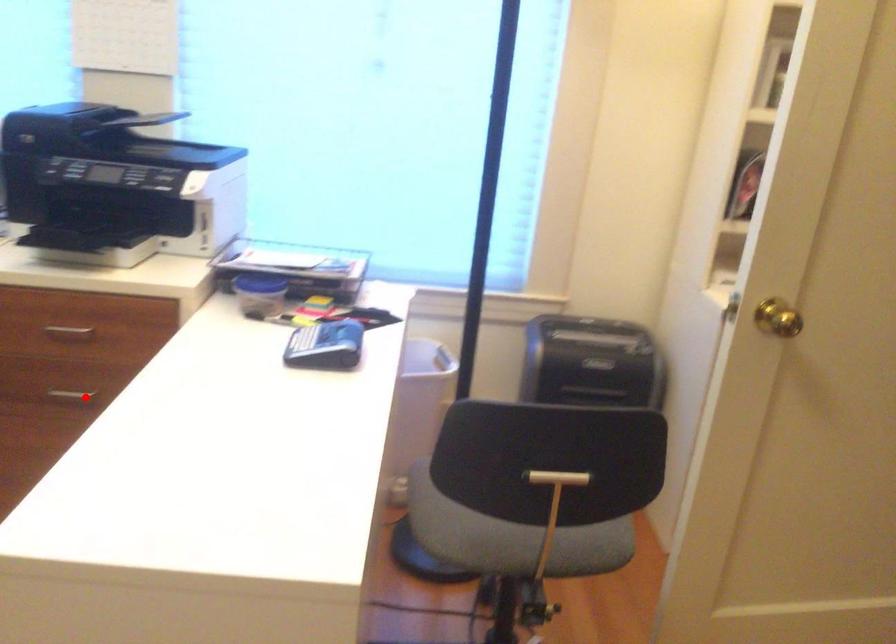
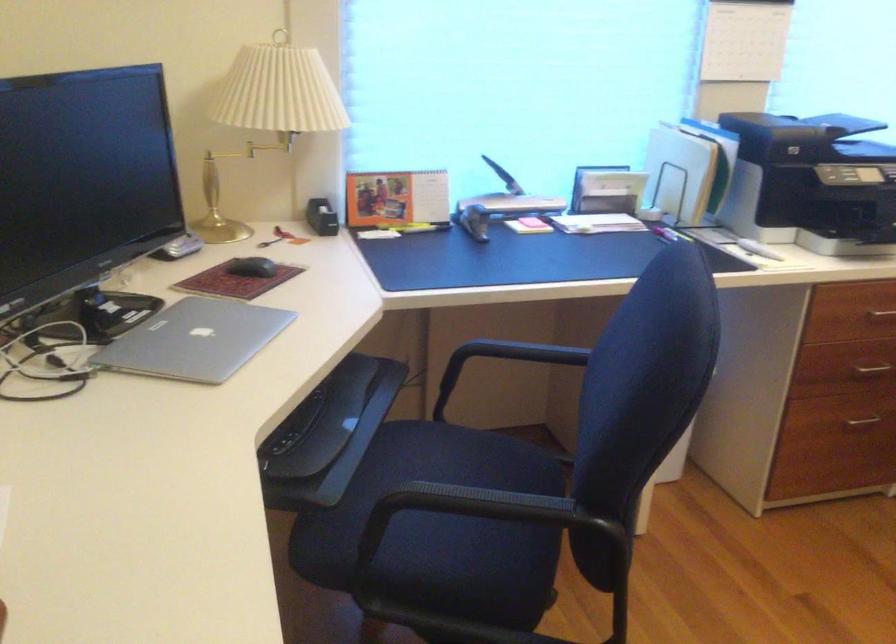
Question: I am providing you with two images of the same scene from different viewpoints. In image1, a red point is highlighted. Considering the same 3D point in image2, which of the following is correct?

Choices:
 (A) It is closer
 (B) It is farther

Answer: (B)